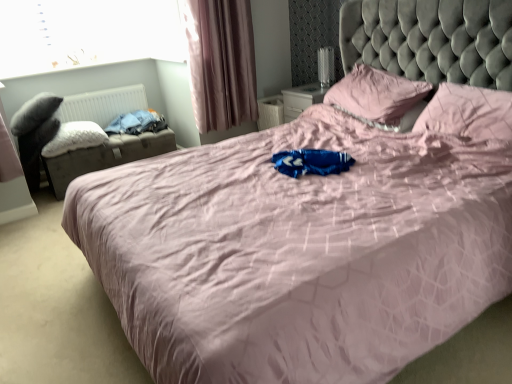
At what (x,y) coordinates should I click in order to perform the action: click on empty space that is ontop of white plastic radiator at left. Please return your answer as a coordinate pair (x, y). Looking at the image, I should click on (96, 91).